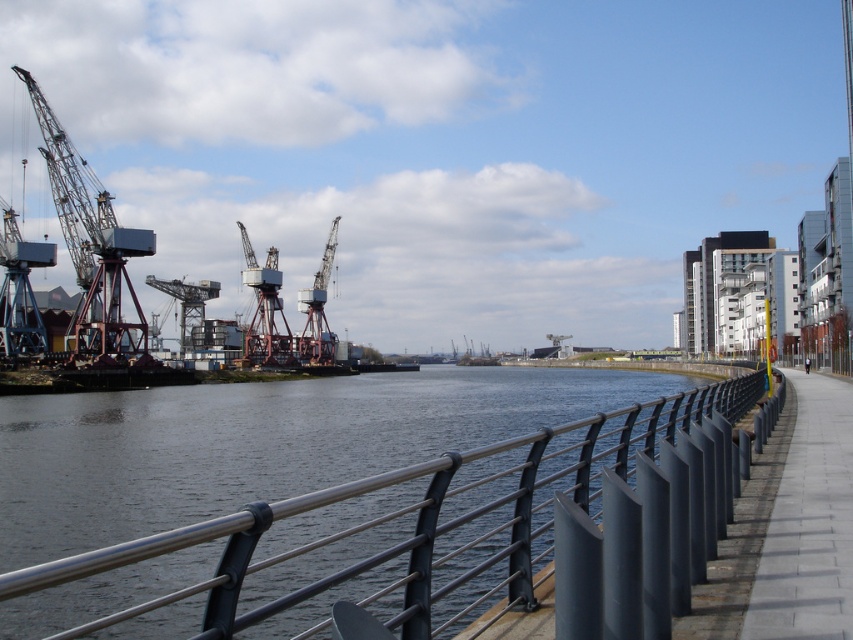
Measure the distance from gray concrete sidewalk at right to metallic industrial crane at left.

gray concrete sidewalk at right and metallic industrial crane at left are 91.86 meters apart from each other.

Between point (782, 481) and point (93, 282), which one is positioned behind?

The point (93, 282) is more distant.

Describe the element at coordinates (809, 524) in the screenshot. The image size is (853, 640). I see `gray concrete sidewalk at right` at that location.

Where is `gray concrete sidewalk at right`? Image resolution: width=853 pixels, height=640 pixels. gray concrete sidewalk at right is located at coordinates (809, 524).

The height and width of the screenshot is (640, 853). Describe the element at coordinates (809, 524) in the screenshot. I see `gray concrete sidewalk at right` at that location.

Is point (840, 515) positioned in front of point (181, 346)?

That is True.

The width and height of the screenshot is (853, 640). Identify the location of gray concrete sidewalk at right. (809, 524).

Which of these two, dark gray water at center or gray concrete sidewalk at right, stands shorter?

Standing shorter between the two is gray concrete sidewalk at right.

Which is above, dark gray water at center or gray concrete sidewalk at right?

gray concrete sidewalk at right

Who is more forward, (135, 509) or (809, 452)?

Point (809, 452) is more forward.

Where is `dark gray water at center`? dark gray water at center is located at coordinates (258, 442).